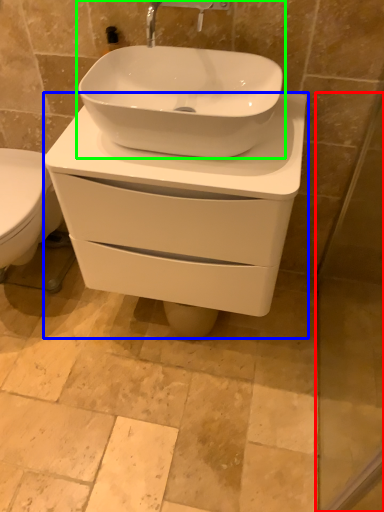
Question: Considering the real-world distances, which object is closest to screen door (highlighted by a red box)? porcelain (highlighted by a blue box) or sink (highlighted by a green box).

Choices:
 (A) porcelain
 (B) sink

Answer: (A)